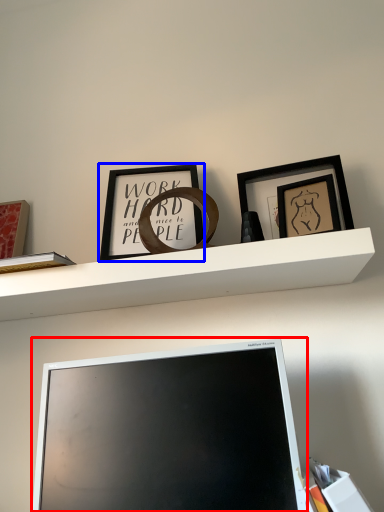
Question: Which object appears closest to the camera in this image, computer monitor (highlighted by a red box) or picture frame (highlighted by a blue box)?

Choices:
 (A) computer monitor
 (B) picture frame

Answer: (A)